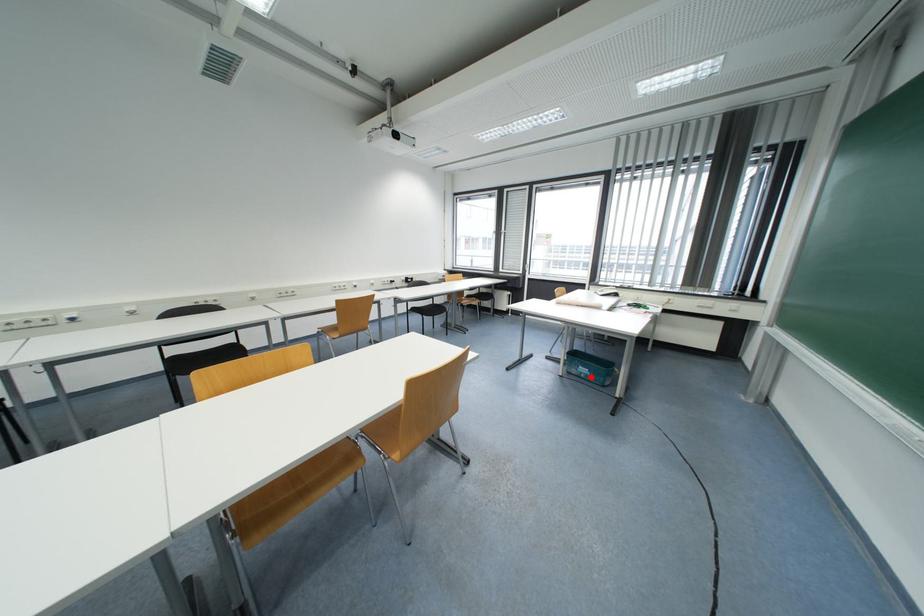
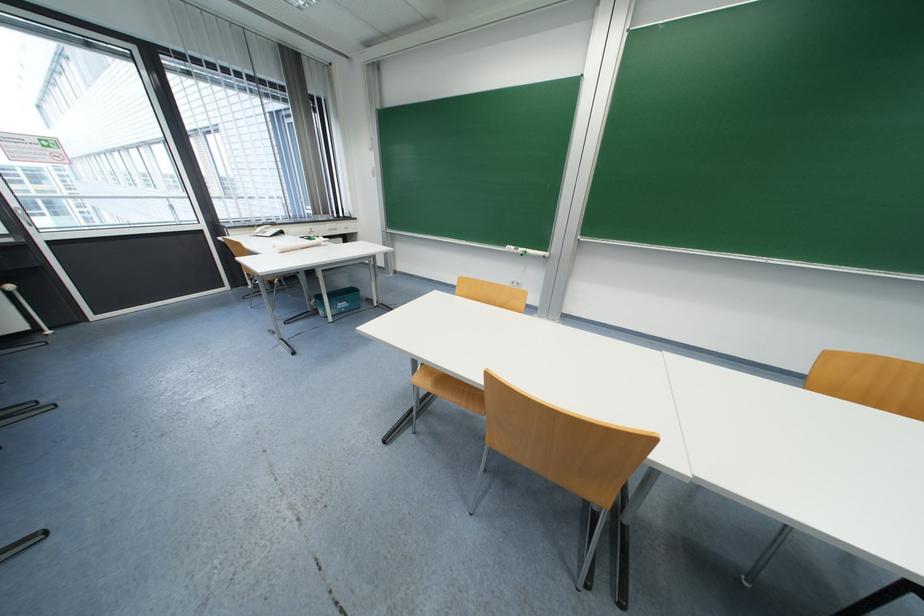
Locate, in the second image, the point that corresponds to the highlighted location in the first image.

(350, 310)